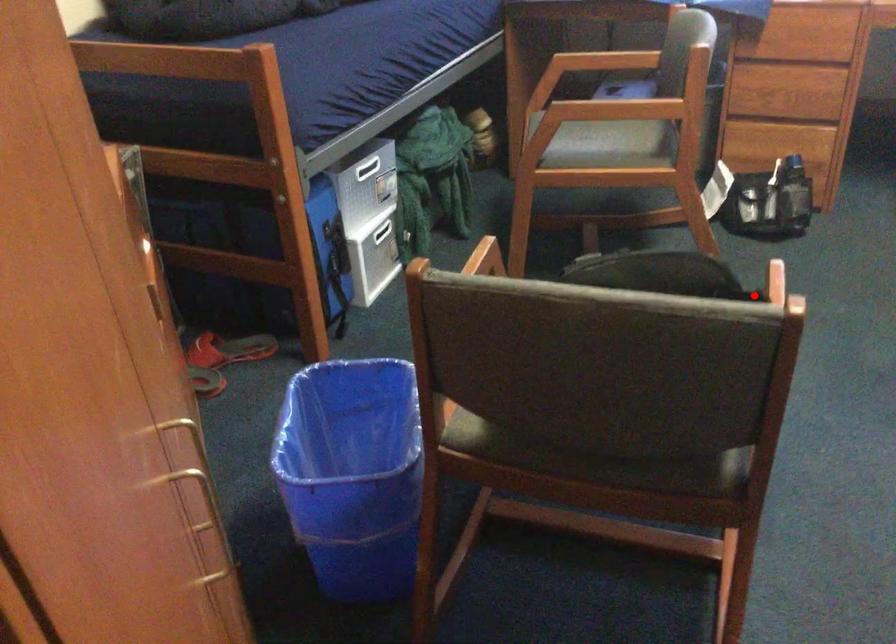
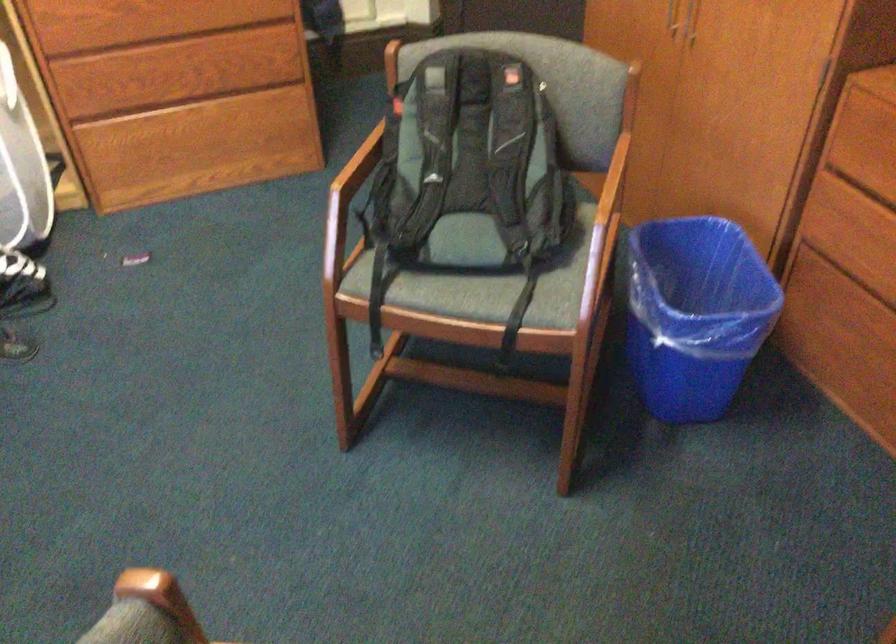
Find the pixel in the second image that matches the highlighted location in the first image.

(350, 183)